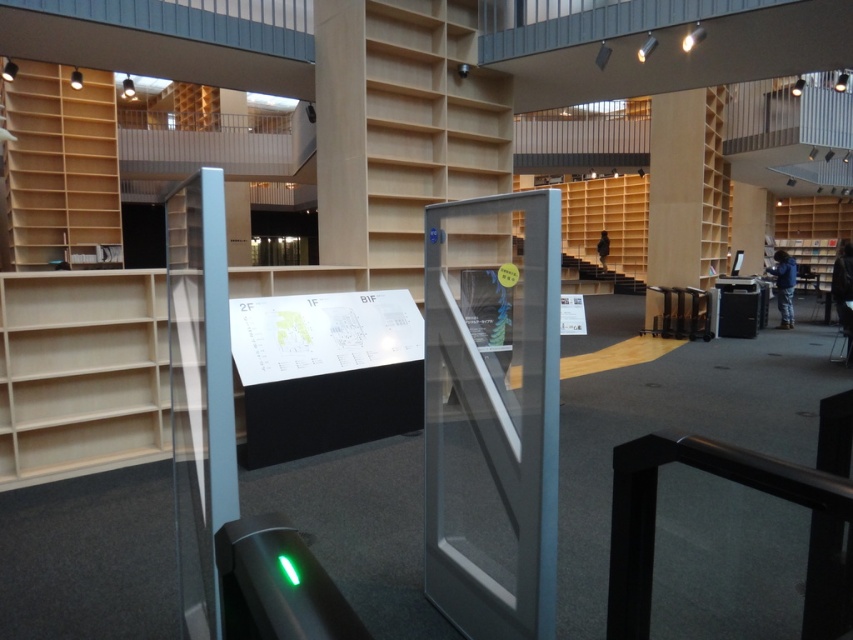
You are standing at the entrance of the library and want to locate the light wood bookshelf at center. According to the floor plan, where is it positioned?

The light wood bookshelf at center is positioned at point (80, 372) on the floor plan.

You are standing in the library and see two points marked in the image. Which point, point (91, 420) or point (624, 272), is closer to you?

Point (91, 420) is closer to the viewer than point (624, 272).

You are a visitor in the library and want to reach the top shelf of the light wood bookshelf at center. Can you stand on the wooden bookshelf at right to reach it?

The light wood bookshelf at center is shorter than the wooden bookshelf at right. Therefore, standing on the wooden bookshelf at right would allow you to reach the top shelf of the light wood bookshelf at center since it is taller.